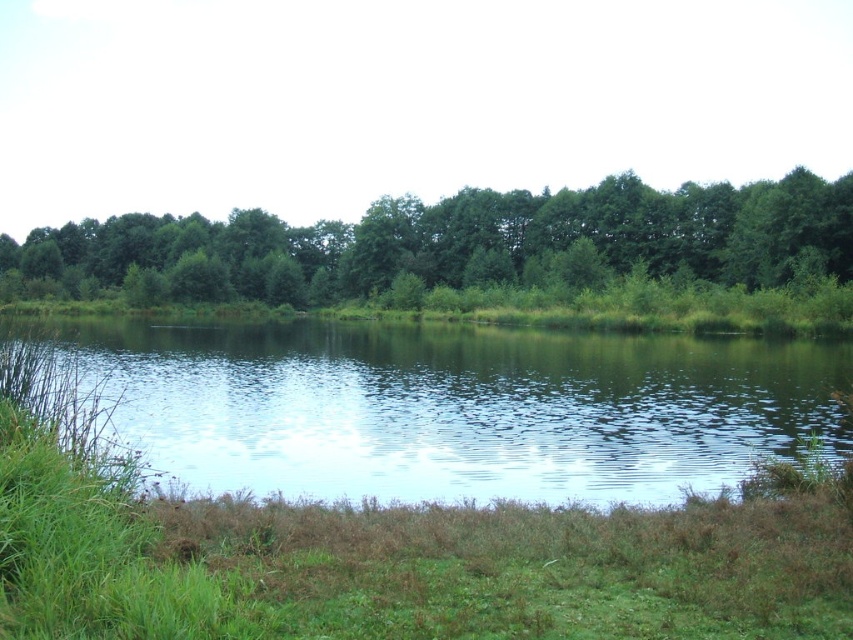
Which is in front, point (773, 500) or point (350, 269)?

Point (773, 500) is in front.

Is green grassy at lower center shorter than green leafy trees at center?

Correct, green grassy at lower center is not as tall as green leafy trees at center.

The image size is (853, 640). What do you see at coordinates (401, 564) in the screenshot? I see `green grassy at lower center` at bounding box center [401, 564].

The height and width of the screenshot is (640, 853). I want to click on green grassy at lower center, so click(x=401, y=564).

In the scene shown: Can you confirm if green reflective water at center is shorter than green grassy at lower center?

Incorrect, green reflective water at center's height does not fall short of green grassy at lower center's.

Is green reflective water at center bigger than green grassy at lower center?

Yes, green reflective water at center is bigger than green grassy at lower center.

Does point (703, 404) come behind point (367, 525)?

That is True.

Identify the location of green reflective water at center. (448, 406).

Can you confirm if green reflective water at center is positioned to the left of green leafy trees at center?

No, green reflective water at center is not to the left of green leafy trees at center.

Who is positioned more to the left, green reflective water at center or green leafy trees at center?

Positioned to the left is green leafy trees at center.

Describe the element at coordinates (448, 406) in the screenshot. The width and height of the screenshot is (853, 640). I see `green reflective water at center` at that location.

What are the coordinates of `green reflective water at center` in the screenshot? It's located at (448, 406).